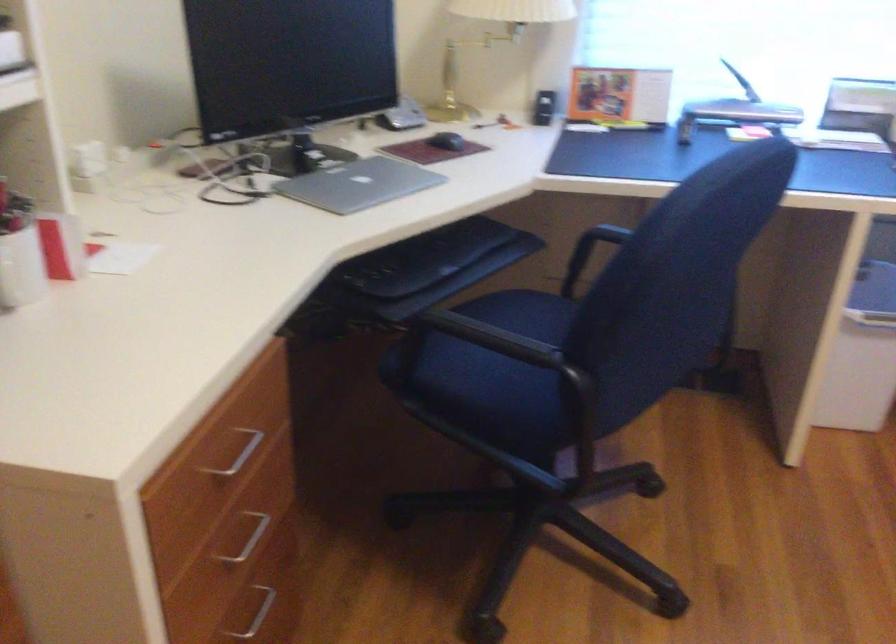
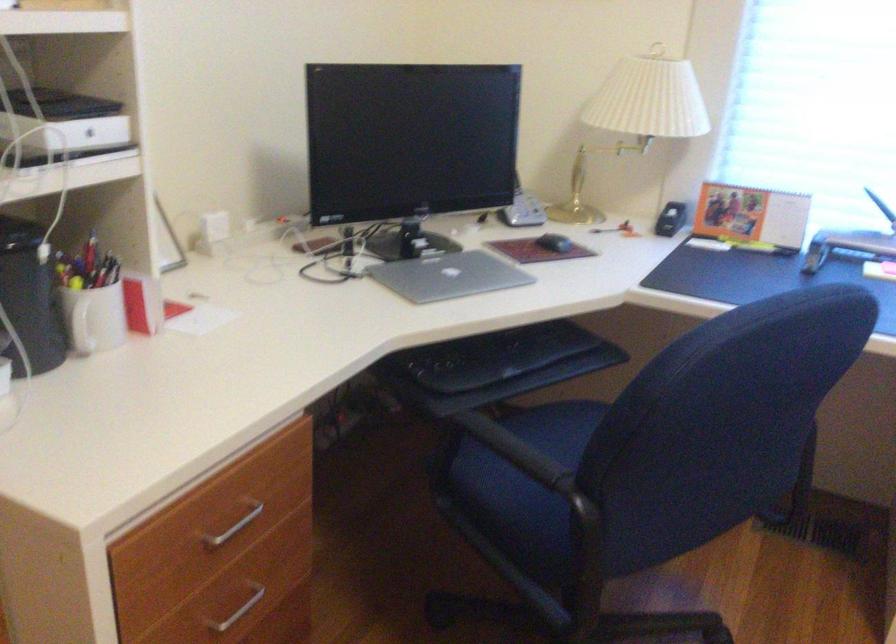
Find the pixel in the second image that matches (238,468) in the first image.

(231, 527)